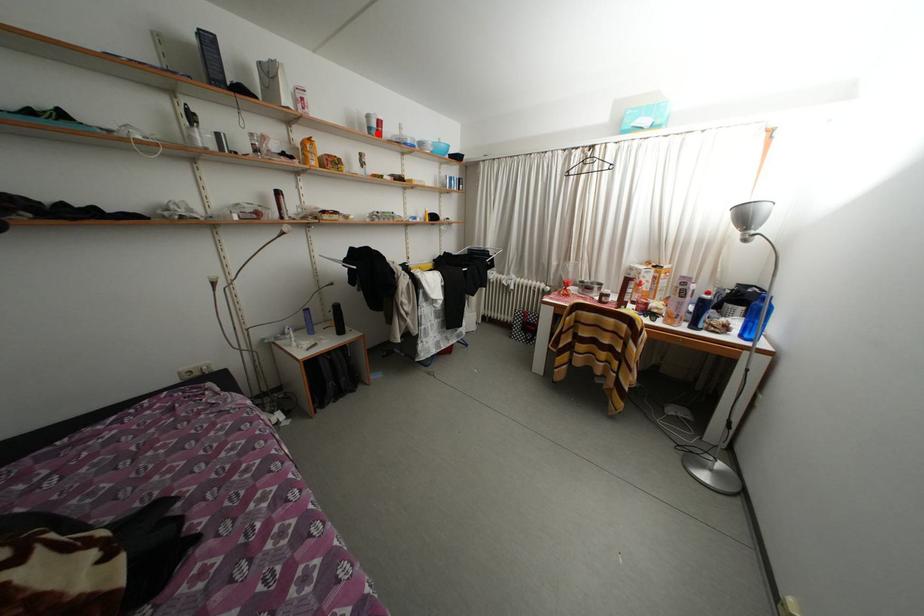
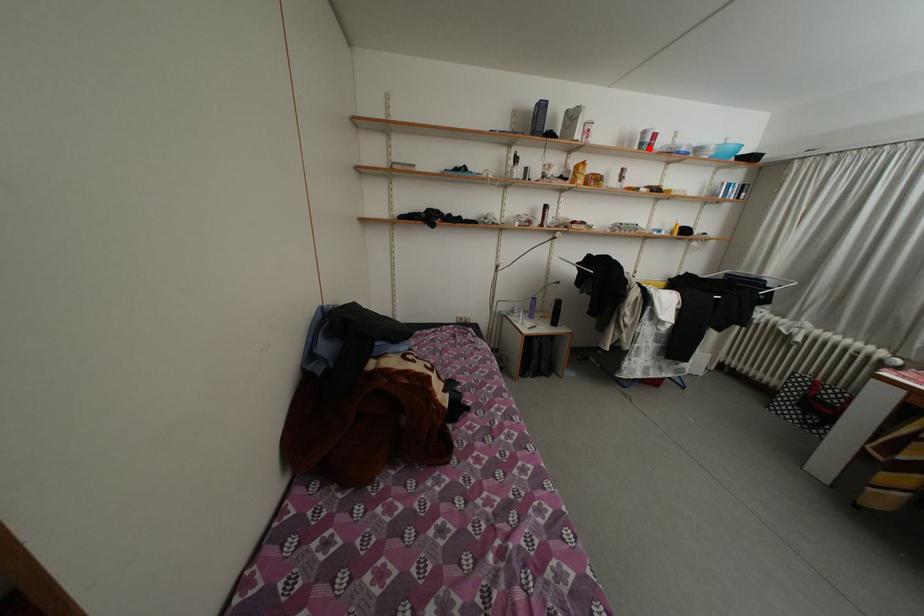
I am providing you with two images of the same scene from different viewpoints. A red point is marked on the first image and another point is marked on the second image. Does the point marked in image1 correspond to the same location as the one in image2?

Yes